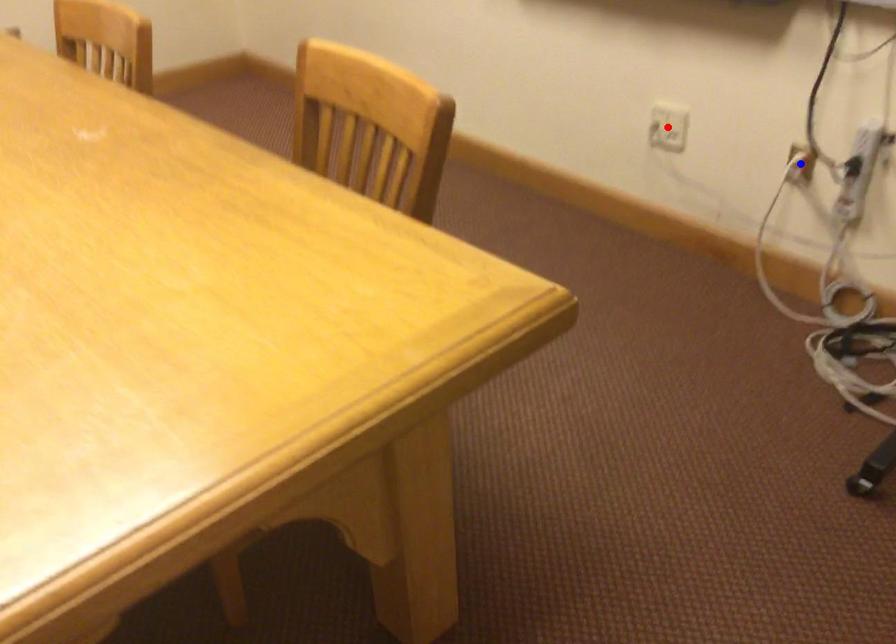
Question: Which of the two points in the image is closer to the camera?

Choices:
 (A) Blue point is closer.
 (B) Red point is closer.

Answer: (A)